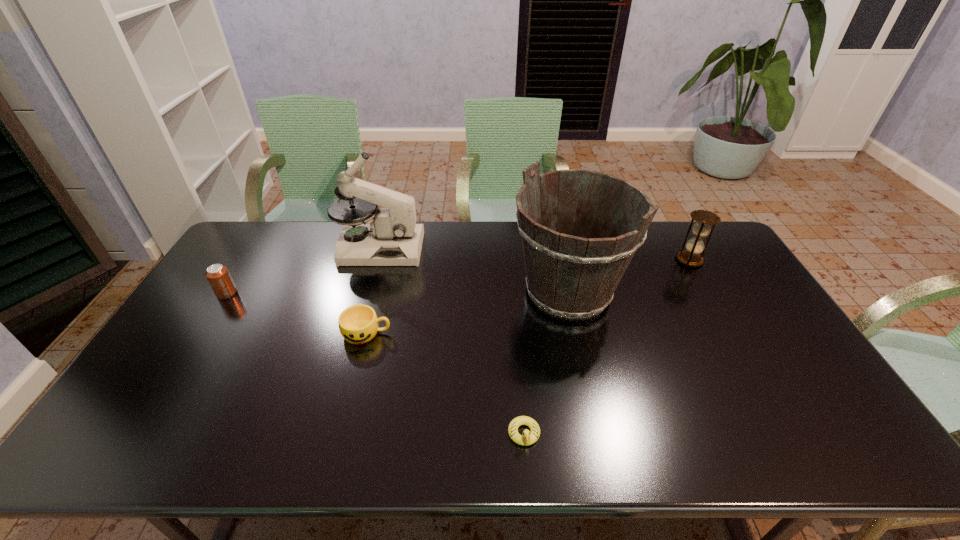
I want to click on unoccupied area between the duckling and the microscope, so click(x=452, y=341).

I want to click on unoccupied position between the bucket and the leftmost object, so click(397, 293).

Locate an element on the screen. The image size is (960, 540). vacant area between the microscope and the cup is located at coordinates tap(373, 291).

Identify the location of vacant area that lies between the fifth tallest object and the bucket. The image size is (960, 540). (468, 312).

Where is `free space between the cup and the third shortest object`? Image resolution: width=960 pixels, height=540 pixels. free space between the cup and the third shortest object is located at coordinates (297, 313).

The width and height of the screenshot is (960, 540). In order to click on free space between the bucket and the fourth shortest object in this screenshot , I will do `click(629, 276)`.

At what (x,y) coordinates should I click in order to perform the action: click on object that stands as the fourth closest to the second shortest object. Please return your answer as a coordinate pair (x, y). This screenshot has width=960, height=540. Looking at the image, I should click on (528, 438).

Locate which object ranks fifth in proximity to the duckling. Please provide its 2D coordinates. Your answer should be formatted as a tuple, i.e. [(x, y)], where the tuple contains the x and y coordinates of a point satisfying the conditions above.

[(218, 275)]

Find the location of a particular element. free location that satisfies the following two spatial constraints: 1. at the eyepiece of the microscope; 2. on the left side of the bucket is located at coordinates (368, 292).

At what (x,y) coordinates should I click in order to perform the action: click on blank space that satisfies the following two spatial constraints: 1. on the back side of the hourglass; 2. on the left side of the can. Please return your answer as a coordinate pair (x, y). The height and width of the screenshot is (540, 960). Looking at the image, I should click on (248, 260).